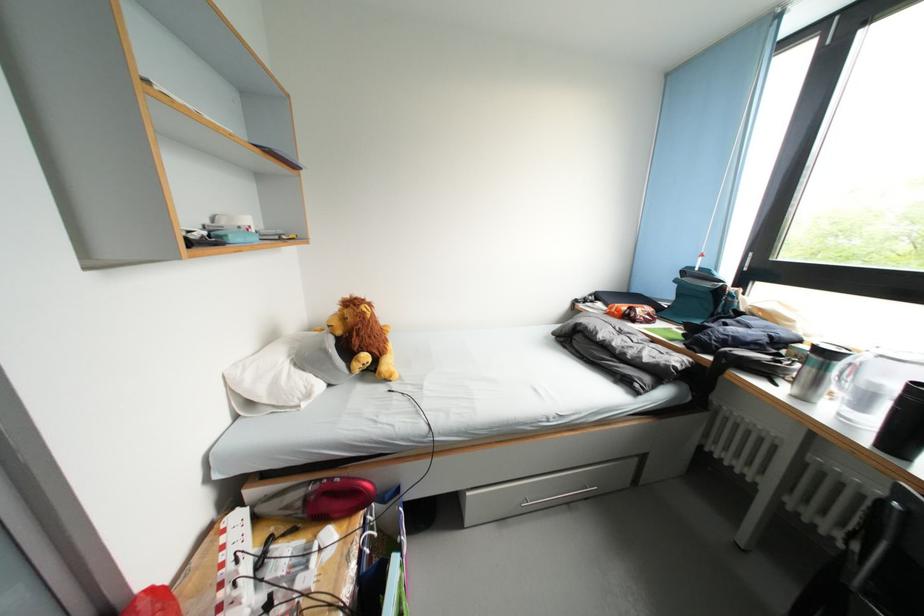
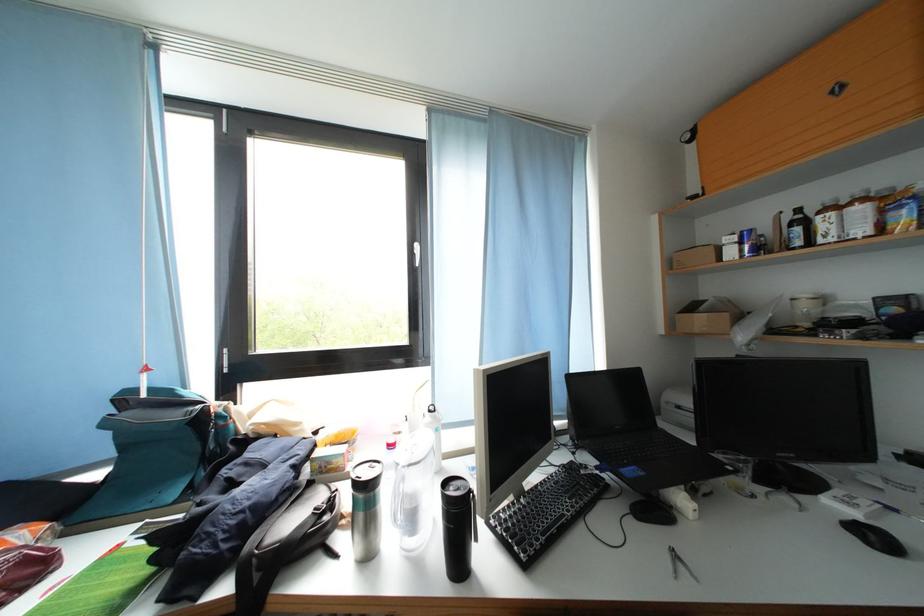
Where in the second image is the point corresponding to (817,376) from the first image?

(369, 521)